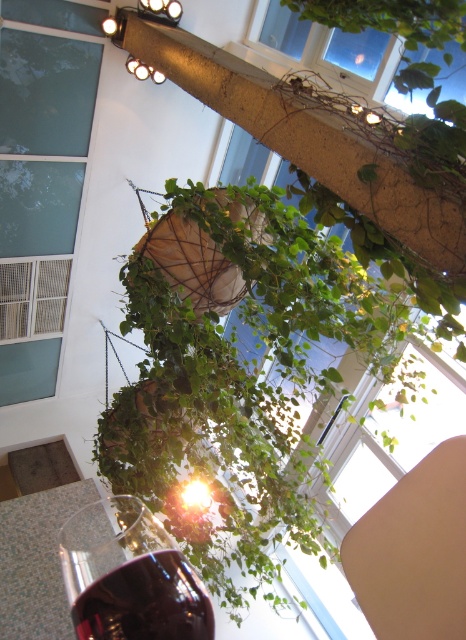
Does green leafy plant at center have a smaller size compared to transparent glass at center?

No.

Is green leafy plant at center wider than transparent glass at center?

Yes, green leafy plant at center is wider than transparent glass at center.

The width and height of the screenshot is (466, 640). What are the coordinates of `green leafy plant at center` in the screenshot? It's located at (239, 381).

Where is `green leafy plant at center`? The width and height of the screenshot is (466, 640). green leafy plant at center is located at coordinates (239, 381).